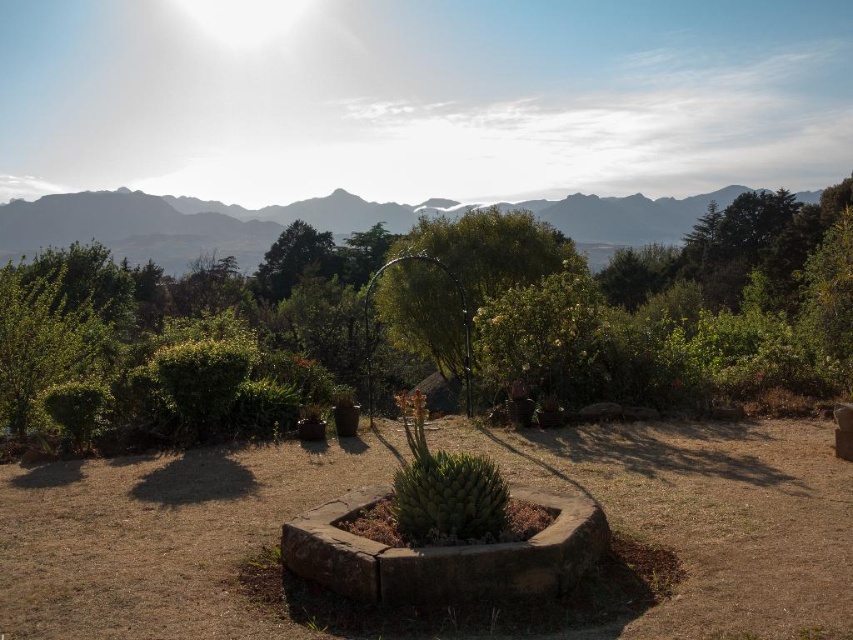
Question: Is green leafy tree at center to the right of green succulent at center from the viewer's perspective?

Choices:
 (A) no
 (B) yes

Answer: (B)

Question: Which point appears closest to the camera in this image?

Choices:
 (A) (424, 468)
 (B) (4, 257)
 (C) (426, 291)

Answer: (A)

Question: Which point is farther from the camera taking this photo?

Choices:
 (A) (642, 221)
 (B) (457, 461)
 (C) (286, 291)

Answer: (A)

Question: Is green succulent at center thinner than green leafy tree at upper center?

Choices:
 (A) yes
 (B) no

Answer: (A)

Question: Does green textured mountain at upper center appear under green leafy tree at center?

Choices:
 (A) yes
 (B) no

Answer: (B)

Question: Among these objects, which one is farthest from the camera?

Choices:
 (A) green textured mountain at upper center
 (B) green leafy tree at center

Answer: (A)